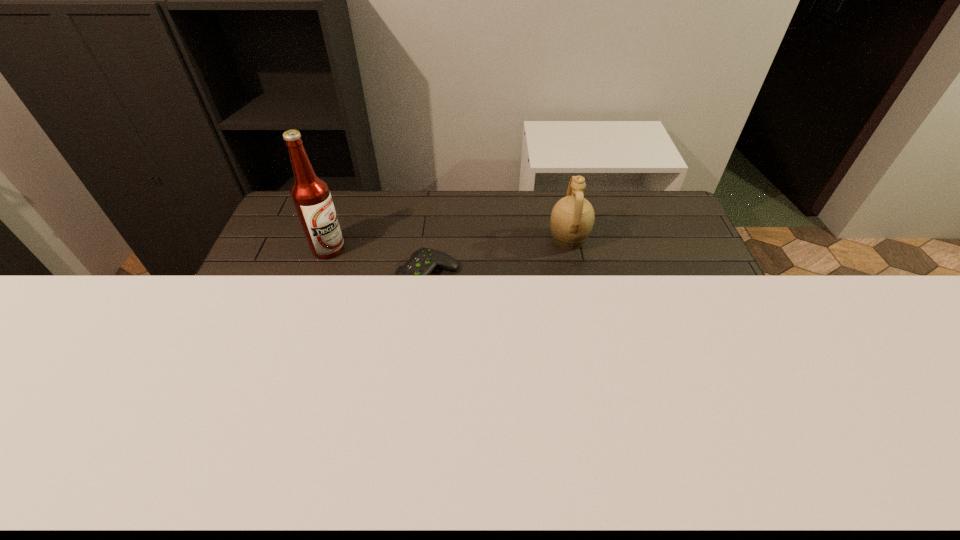
Where is `the tallest object`? This screenshot has height=540, width=960. the tallest object is located at coordinates (310, 194).

Identify the location of the leftmost object. (310, 194).

Where is `the rightmost object`? The height and width of the screenshot is (540, 960). the rightmost object is located at coordinates (572, 218).

Locate an element on the screen. the second shortest object is located at coordinates (572, 218).

Where is `the second object from left to right`? the second object from left to right is located at coordinates (423, 261).

Locate an element on the screen. The height and width of the screenshot is (540, 960). control is located at coordinates (423, 261).

Locate an element on the screen. The image size is (960, 540). vacant space located 0.230m on the label side of the alcohol is located at coordinates (414, 249).

Where is `vacant region located 0.370m on the left of the pitcher`? vacant region located 0.370m on the left of the pitcher is located at coordinates (439, 240).

At what (x,y) coordinates should I click in order to perform the action: click on vacant space positioned on the right of the control. Please return your answer as a coordinate pair (x, y). This screenshot has height=540, width=960. Looking at the image, I should click on (511, 279).

Image resolution: width=960 pixels, height=540 pixels. I want to click on object that is at the far edge, so click(572, 218).